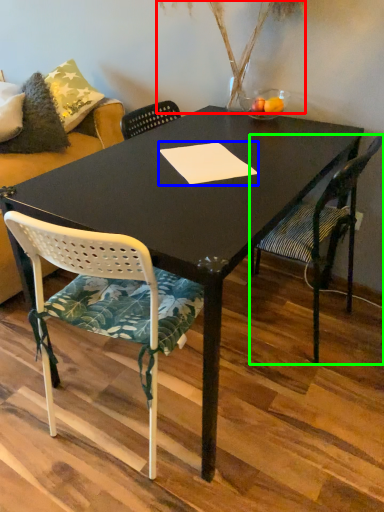
Question: Which object is positioned closest to plant (highlighted by a red box)? Select from notepad (highlighted by a blue box) and chair (highlighted by a green box).

Choices:
 (A) notepad
 (B) chair

Answer: (A)